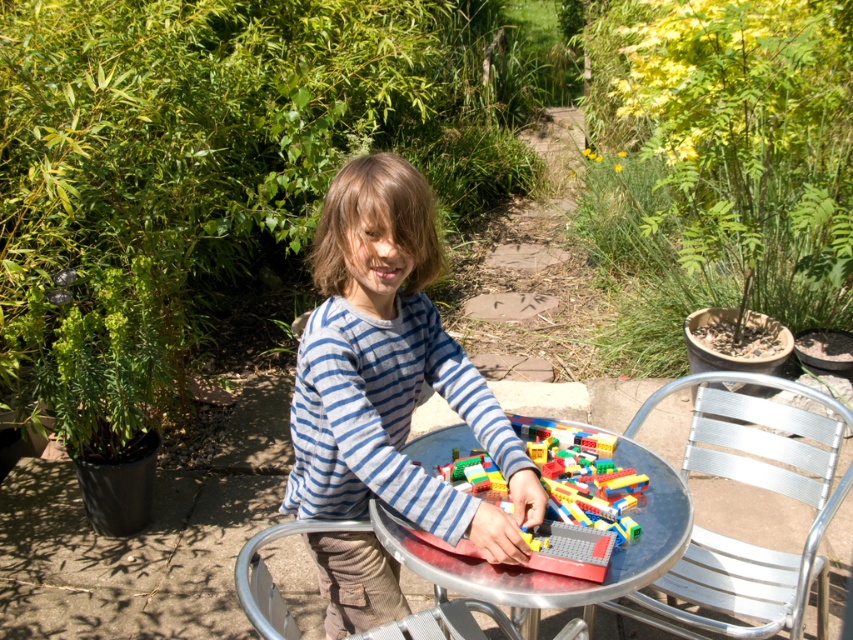
You are a photographer taking a picture of the child and the LEGO bricks. You want to focus on the point that is closer to the camera. Which point should you choose between point [560,605] and point [619,468]?

Point [560,605] is closer to the camera than point [619,468], so you should choose point [560,605] to focus on the closer point.

You are a photographer trying to capture the child in the image. The focus point of your camera is set to point (x=387, y=369). Based on the scene, what part of the child will be in focus?

The focus point at (x=387, y=369) corresponds to the blue striped shirt at center, so the blue striped shirt at center will be in focus.

You are a parent trying to organize the LEGO bricks. If you want to place all the bright plastic lego bricks at center onto the metallic silver table at center, will there be enough space?

The metallic silver table at center has a larger size compared to bright plastic lego bricks at center, so yes, there will be enough space to place all the bright plastic lego bricks at center onto the metallic silver table at center.